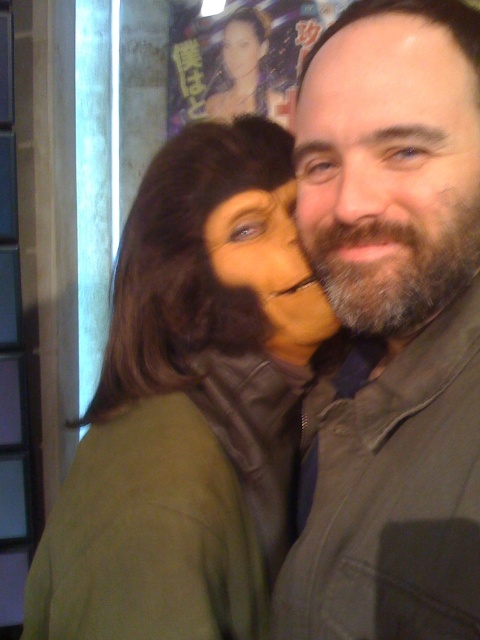
Who is lower down, matte olive green jacket at center or matte brown hair at center?

matte olive green jacket at center is lower down.

Who is taller, matte olive green jacket at center or matte brown hair at center?

matte olive green jacket at center

What are the coordinates of `matte olive green jacket at center` in the screenshot? It's located at (393, 326).

Does green matte jacket at center have a lesser width compared to bearded man at center?

No.

Between green matte jacket at center and bearded man at center, which one is positioned lower?

Positioned lower is green matte jacket at center.

Between point (99, 541) and point (446, 70), which one is positioned behind?

Positioned behind is point (99, 541).

Where is `green matte jacket at center`? green matte jacket at center is located at coordinates (190, 404).

Does point (409, 300) come in front of point (414, 228)?

No, it is not.

Is point (457, 227) behind point (367, 259)?

No, it is not.

Who is more distant from viewer, (383,212) or (334,256)?

The point (334,256) is more distant.

What are the coordinates of `bearded man at center` in the screenshot? It's located at (388, 170).